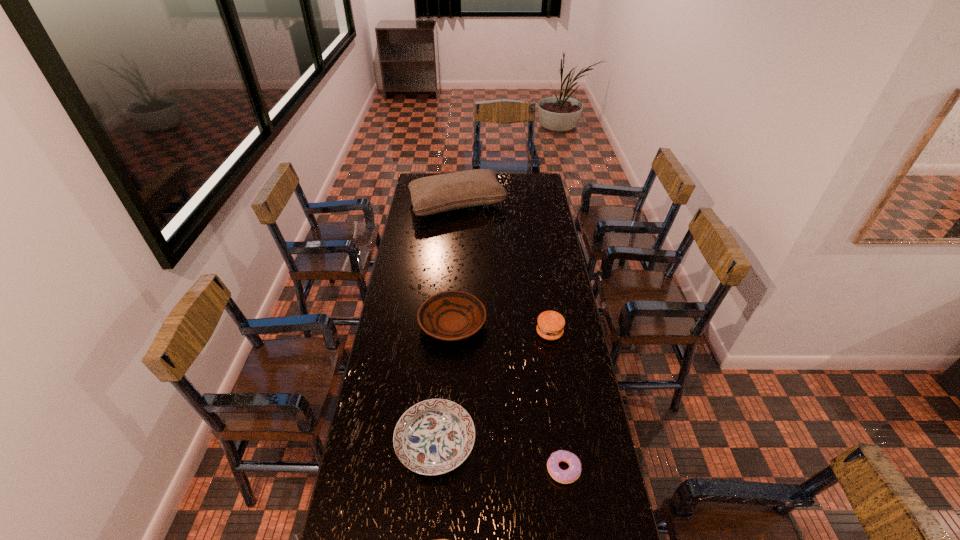
This screenshot has width=960, height=540. In order to click on free spot located 0.060m on the left of the second tallest plate in this screenshot , I will do `click(377, 442)`.

This screenshot has height=540, width=960. I want to click on free space located 0.130m on the left of the doughnut, so click(505, 469).

Image resolution: width=960 pixels, height=540 pixels. What are the coordinates of `object that is at the far edge` in the screenshot? It's located at (430, 195).

Where is `cushion positioned at the left edge`? cushion positioned at the left edge is located at coordinates (430, 195).

The height and width of the screenshot is (540, 960). Find the location of `patty present at the right edge`. patty present at the right edge is located at coordinates 550,325.

Find the location of a particular element. doughnut that is at the right edge is located at coordinates click(x=568, y=476).

I want to click on object present at the far left corner, so click(x=430, y=195).

In the image, there is a desktop. Where is `free space at the left edge`? Image resolution: width=960 pixels, height=540 pixels. free space at the left edge is located at coordinates (395, 328).

Where is `free space at the right edge`? The width and height of the screenshot is (960, 540). free space at the right edge is located at coordinates (547, 205).

Find the location of a particular element. free space between the second nearest plate and the doughnut is located at coordinates coord(499,455).